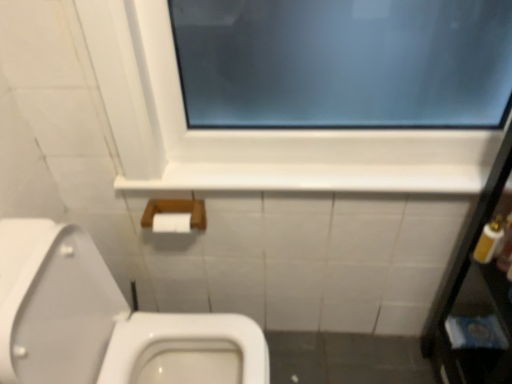
The width and height of the screenshot is (512, 384). Describe the element at coordinates (477, 293) in the screenshot. I see `metallic silver mirror at right` at that location.

This screenshot has height=384, width=512. In order to click on white plastic bottle at right, the second toiletry from the left in this screenshot , I will do `click(506, 247)`.

This screenshot has height=384, width=512. What do you see at coordinates (489, 240) in the screenshot?
I see `white plastic bottle at right, arranged as the 2th toiletry when viewed from the right` at bounding box center [489, 240].

I want to click on white plastic bottle at right, the first toiletry when ordered from left to right, so click(x=489, y=240).

The height and width of the screenshot is (384, 512). In order to click on white glossy ledge at upper center in this screenshot , I will do `click(313, 178)`.

I want to click on metallic silver mirror at right, so click(477, 293).

Is white plastic bottle at right, the first toiletry when ordered from left to right, at the right side of white plastic bottle at right, acting as the 1th toiletry starting from the right?

No.

This screenshot has width=512, height=384. I want to click on toiletry that is below the white plastic bottle at right, the first toiletry when ordered from left to right (from the image's perspective), so click(x=506, y=247).

Is point (502, 237) farther from camera compared to point (503, 260)?

No, (502, 237) is closer to viewer.

Which of these two, white plastic bottle at right, arranged as the 2th toiletry when viewed from the right, or white plastic bottle at right, acting as the 1th toiletry starting from the right, is bigger?

Bigger between the two is white plastic bottle at right, acting as the 1th toiletry starting from the right.

Who is bigger, white plastic bottle at right, the first toiletry when ordered from left to right, or white glossy ledge at upper center?

Bigger between the two is white glossy ledge at upper center.

Is white plastic bottle at right, arranged as the 2th toiletry when viewed from the right, directly adjacent to white glossy ledge at upper center?

white plastic bottle at right, arranged as the 2th toiletry when viewed from the right, is not next to white glossy ledge at upper center, and they're not touching.

Consider the image. Which point is more distant from viewer, [476,256] or [178,185]?

Positioned behind is point [178,185].

Is white glossy ledge at upper center positioned with its back to wooden box at lower center?

That's not correct — white glossy ledge at upper center is not looking away from wooden box at lower center.

This screenshot has height=384, width=512. What are the coordinates of `towel bar on the left of white glossy ledge at upper center` in the screenshot? It's located at (176, 210).

From a real-world perspective, is white glossy ledge at upper center physically located above or below wooden box at lower center?

white glossy ledge at upper center is above wooden box at lower center.

How much distance is there between white glossy ledge at upper center and wooden box at lower center?

white glossy ledge at upper center and wooden box at lower center are 10.62 inches apart from each other.

Would you say white plastic bottle at right, arranged as the 2th toiletry when viewed from the right, is part of white glossy toilet at lower left's contents?

That's incorrect, white plastic bottle at right, arranged as the 2th toiletry when viewed from the right, is not inside white glossy toilet at lower left.

Looking at this image, based on their sizes in the image, would you say white glossy toilet at lower left is bigger or smaller than white plastic bottle at right, the first toiletry when ordered from left to right?

Considering their sizes, white glossy toilet at lower left takes up more space than white plastic bottle at right, the first toiletry when ordered from left to right.

Considering the sizes of objects white glossy toilet at lower left and white plastic bottle at right, arranged as the 2th toiletry when viewed from the right, in the image provided, who is taller, white glossy toilet at lower left or white plastic bottle at right, arranged as the 2th toiletry when viewed from the right,?

With more height is white glossy toilet at lower left.

How much distance is there between white glossy toilet at lower left and white plastic bottle at right, the first toiletry when ordered from left to right?

They are 36.57 inches apart.

How distant is white glossy ledge at upper center from metallic silver mirror at right?

white glossy ledge at upper center is 44.02 centimeters away from metallic silver mirror at right.

Is white glossy ledge at upper center oriented towards metallic silver mirror at right?

No.

Which is behind, white glossy ledge at upper center or metallic silver mirror at right?

white glossy ledge at upper center is further away from the camera.

Does white glossy ledge at upper center have a smaller size compared to metallic silver mirror at right?

Correct, white glossy ledge at upper center occupies less space than metallic silver mirror at right.

This screenshot has height=384, width=512. Find the location of `medicine cabinet that appears below the white plastic bottle at right, acting as the 1th toiletry starting from the right (from the image's perspective)`. medicine cabinet that appears below the white plastic bottle at right, acting as the 1th toiletry starting from the right (from the image's perspective) is located at coordinates (477, 293).

What's the angular difference between metallic silver mirror at right and white plastic bottle at right, acting as the 1th toiletry starting from the right,'s facing directions?

The facing directions of metallic silver mirror at right and white plastic bottle at right, acting as the 1th toiletry starting from the right, are 85.4 degrees apart.

From a real-world perspective, is metallic silver mirror at right physically below white plastic bottle at right, the second toiletry from the left?

Yes, from a real-world perspective, metallic silver mirror at right is under white plastic bottle at right, the second toiletry from the left.

Between metallic silver mirror at right and white plastic bottle at right, acting as the 1th toiletry starting from the right, which one has more height?

metallic silver mirror at right is taller.

Considering the positions of point (509, 253) and point (169, 207), is point (509, 253) closer or farther from the camera than point (169, 207)?

Point (509, 253) is closer to the camera than point (169, 207).

From a real-world perspective, is white plastic bottle at right, the second toiletry from the left, on wooden box at lower center?

Indeed, from a real-world perspective, white plastic bottle at right, the second toiletry from the left, stands above wooden box at lower center.

Can you tell me how much white plastic bottle at right, acting as the 1th toiletry starting from the right, and wooden box at lower center differ in facing direction?

89.6 degrees separate the facing orientations of white plastic bottle at right, acting as the 1th toiletry starting from the right, and wooden box at lower center.

From the image's perspective, which object appears higher, white plastic bottle at right, acting as the 1th toiletry starting from the right, or wooden box at lower center?

From the image's view, wooden box at lower center is above.

At what (x,y) coordinates should I click in order to perform the action: click on toiletry behind the white plastic bottle at right, acting as the 1th toiletry starting from the right. Please return your answer as a coordinate pair (x, y). This screenshot has height=384, width=512. Looking at the image, I should click on (489, 240).

This screenshot has height=384, width=512. In order to click on ledge above the white plastic bottle at right, arranged as the 2th toiletry when viewed from the right (from a real-world perspective) in this screenshot , I will do `click(313, 178)`.

Which object lies further to the anchor point metallic silver mirror at right, white plastic bottle at right, the first toiletry when ordered from left to right, or white plastic bottle at right, the second toiletry from the left?

white plastic bottle at right, the first toiletry when ordered from left to right, lies further to metallic silver mirror at right than the other object.

Estimate the real-world distances between objects in this image. Which object is further from white glossy ledge at upper center, white plastic bottle at right, arranged as the 2th toiletry when viewed from the right, or wooden box at lower center?

The object further to white glossy ledge at upper center is white plastic bottle at right, arranged as the 2th toiletry when viewed from the right.

When comparing their distances from white plastic bottle at right, the first toiletry when ordered from left to right, does white glossy ledge at upper center or white glossy toilet at lower left seem closer?

white glossy ledge at upper center.

Which object lies further to the anchor point wooden box at lower center, white plastic bottle at right, acting as the 1th toiletry starting from the right, or white glossy toilet at lower left?

Among the two, white plastic bottle at right, acting as the 1th toiletry starting from the right, is located further to wooden box at lower center.

When comparing their distances from white glossy ledge at upper center, does metallic silver mirror at right or white plastic bottle at right, the first toiletry when ordered from left to right, seem closer?

Based on the image, white plastic bottle at right, the first toiletry when ordered from left to right, appears to be nearer to white glossy ledge at upper center.

From the image, which object appears to be nearer to white plastic bottle at right, acting as the 1th toiletry starting from the right, metallic silver mirror at right or white glossy toilet at lower left?

metallic silver mirror at right.

Looking at the image, which one is located further to white plastic bottle at right, acting as the 1th toiletry starting from the right, white plastic bottle at right, the first toiletry when ordered from left to right, or white glossy toilet at lower left?

white glossy toilet at lower left is further to white plastic bottle at right, acting as the 1th toiletry starting from the right.

Based on their spatial positions, is wooden box at lower center or white glossy toilet at lower left further from white plastic bottle at right, the second toiletry from the left?

white glossy toilet at lower left is further to white plastic bottle at right, the second toiletry from the left.

The width and height of the screenshot is (512, 384). In order to click on toiletry situated between white glossy ledge at upper center and white plastic bottle at right, acting as the 1th toiletry starting from the right, from left to right in this screenshot , I will do `click(489, 240)`.

The height and width of the screenshot is (384, 512). I want to click on toiletry located between metallic silver mirror at right and white plastic bottle at right, arranged as the 2th toiletry when viewed from the right, in the depth direction, so click(506, 247).

The height and width of the screenshot is (384, 512). Identify the location of ledge between wooden box at lower center and metallic silver mirror at right. (313, 178).

Locate an element on the screen. The height and width of the screenshot is (384, 512). ledge between white glossy toilet at lower left and white plastic bottle at right, the second toiletry from the left, from left to right is located at coordinates (313, 178).